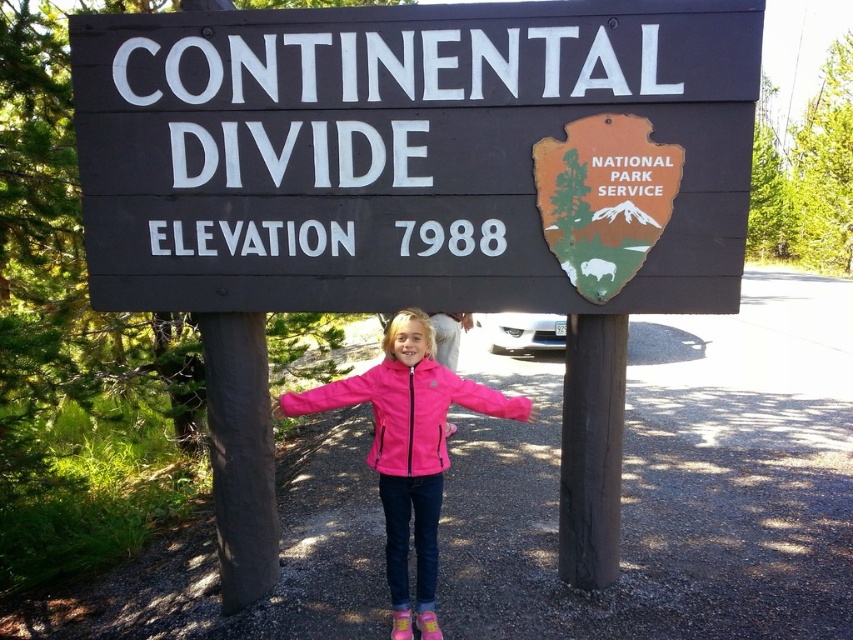
Is brown wood pole at left behind black wood pole at center?

Yes.

Who is lower down, brown wood pole at left or black wood pole at center?

Positioned lower is brown wood pole at left.

Between point (222, 426) and point (616, 372), which one is positioned in front?

Positioned in front is point (616, 372).

Identify the location of brown wood pole at left. (241, 456).

Does dark wood sign at center appear on the right side of brown wood pole at left?

Yes, dark wood sign at center is to the right of brown wood pole at left.

Which is in front, point (601, 58) or point (219, 355)?

Positioned in front is point (601, 58).

The image size is (853, 640). I want to click on dark wood sign at center, so click(x=402, y=154).

Which of these two, brown wood pole at left or pink fleece jacket at center, stands shorter?

Standing shorter between the two is pink fleece jacket at center.

Which is above, brown wood pole at left or pink fleece jacket at center?

pink fleece jacket at center

Consider the image. Who is more forward, (209,412) or (335,385)?

Positioned in front is point (335,385).

Find the location of `brown wood pole at left`. brown wood pole at left is located at coordinates (241, 456).